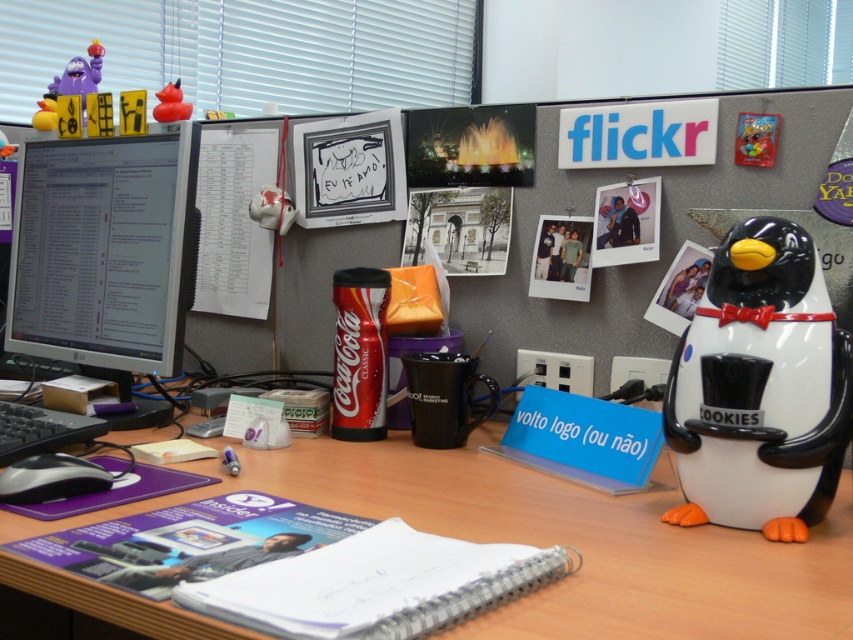
Question: Which point is farther to the camera?

Choices:
 (A) white paper at upper center
 (B) wooden at center
 (C) matte black monitor at left
 (D) rubber duck at upper left

Answer: (A)

Question: Does wooden at center appear over rubber duck at upper left?

Choices:
 (A) yes
 (B) no

Answer: (B)

Question: Which point is closer to the camera taking this photo?

Choices:
 (A) (190, 106)
 (B) (805, 236)
 (C) (209, 140)

Answer: (B)

Question: Does white paper at upper center have a greater width compared to rubber duck at upper left?

Choices:
 (A) yes
 (B) no

Answer: (A)

Question: Can you confirm if white glossy penguin cookies jar at right is bigger than matte black monitor at left?

Choices:
 (A) yes
 (B) no

Answer: (B)

Question: Estimate the real-world distances between objects in this image. Which object is closer to the matte black monitor at left?

Choices:
 (A) rubber duck at upper left
 (B) white paper at upper center

Answer: (A)